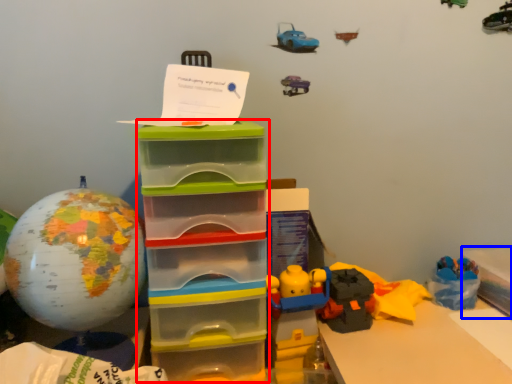
Question: Which of the following is the closest to the observer, storage box (highlighted by a red box) or storage box (highlighted by a blue box)?

Choices:
 (A) storage box
 (B) storage box

Answer: (A)